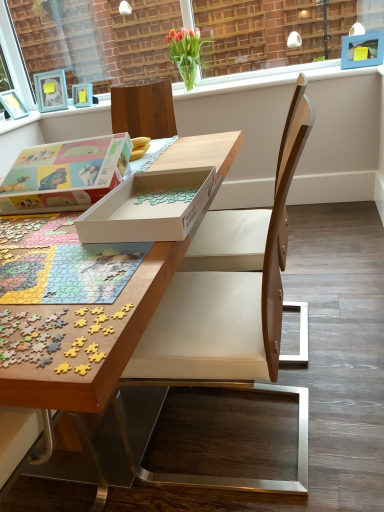
The width and height of the screenshot is (384, 512). Describe the element at coordinates (362, 50) in the screenshot. I see `blue plastic picture frame at upper right, the 2th picture frame in the left-to-right sequence` at that location.

Locate an element on the screen. white cardboard box at center, which ranks as the 1th box in left-to-right order is located at coordinates (65, 175).

Find the location of `white cardboard box at center, the 2th box from the left`. white cardboard box at center, the 2th box from the left is located at coordinates (149, 207).

I want to click on wooden chair at center, so click(x=230, y=315).

From the image's perspective, is white cardboard box at center, the 1th box when ordered from right to left, positioned above or below white cardboard box at center, which ranks as the 1th box in left-to-right order?

Clearly, from the image's perspective, white cardboard box at center, the 1th box when ordered from right to left, is below white cardboard box at center, which ranks as the 1th box in left-to-right order.

From a real-world perspective, between white cardboard box at center, the 1th box when ordered from right to left, and white cardboard box at center, which ranks as the 1th box in left-to-right order, who is vertically lower?

white cardboard box at center, the 1th box when ordered from right to left.

Which object is further away from the camera taking this photo, white cardboard box at center, the 2th box from the left, or white cardboard box at center, which is the second box from right to left?

white cardboard box at center, which is the second box from right to left, is behind.

Is wooden puzzle pieces at center spatially inside white cardboard box at center, the 2th box from the left, or outside of it?

wooden puzzle pieces at center is located beyond the bounds of white cardboard box at center, the 2th box from the left.

Between point (3, 487) and point (189, 208), which one is positioned behind?

The point (3, 487) is farther.

How many degrees apart are the facing directions of wooden puzzle pieces at center and white cardboard box at center, the 1th box when ordered from right to left?

The angular difference between wooden puzzle pieces at center and white cardboard box at center, the 1th box when ordered from right to left, is 0.755 degrees.

Which is in front, point (92, 76) or point (73, 96)?

The point (73, 96) is closer.

Is white plastic window frame at upper center facing away from matte blue picture frame at upper left, the 1th picture frame when ordered from back to front?

Yes.

Would you say wooden chair at center is inside or outside white plastic window frame at upper center?

wooden chair at center is outside white plastic window frame at upper center.

Considering the sizes of objects wooden chair at center and white plastic window frame at upper center in the image provided, who is smaller, wooden chair at center or white plastic window frame at upper center?

With smaller size is white plastic window frame at upper center.

Does wooden chair at center touch white plastic window frame at upper center?

No, wooden chair at center is not beside white plastic window frame at upper center.

From the image's perspective, does wooden chair at center appear higher than white plastic window frame at upper center?

No, from the image's perspective, wooden chair at center is not on top of white plastic window frame at upper center.

From a real-world perspective, who is located lower, wooden puzzle pieces at center or white cardboard box at center, which ranks as the 1th box in left-to-right order?

In real-world perspective, wooden puzzle pieces at center is lower.

Considering the sizes of wooden puzzle pieces at center and white cardboard box at center, which is the second box from right to left, in the image, is wooden puzzle pieces at center taller or shorter than white cardboard box at center, which is the second box from right to left,?

Clearly, wooden puzzle pieces at center is taller compared to white cardboard box at center, which is the second box from right to left.

From the image's perspective, is wooden puzzle pieces at center located above or below white cardboard box at center, which is the second box from right to left?

Clearly, from the image's perspective, wooden puzzle pieces at center is below white cardboard box at center, which is the second box from right to left.

How distant is wooden puzzle pieces at center from white cardboard box at center, which is the second box from right to left?

wooden puzzle pieces at center and white cardboard box at center, which is the second box from right to left, are 11.86 inches apart from each other.

From the white cardboard box at center, which is the second box from right to left, count 1st picture frames backward and point to it. Please provide its 2D coordinates.

[(362, 50)]

Is blue plastic picture frame at upper right, the 2th picture frame in the left-to-right sequence, looking in the opposite direction of white cardboard box at center, which ranks as the 1th box in left-to-right order?

blue plastic picture frame at upper right, the 2th picture frame in the left-to-right sequence, does not have its back to white cardboard box at center, which ranks as the 1th box in left-to-right order.

Is blue plastic picture frame at upper right, which ranks as the second picture frame in back-to-front order, behind white cardboard box at center, which ranks as the 1th box in left-to-right order?

Yes.

From the image's perspective, who appears lower, blue plastic picture frame at upper right, placed as the 1th picture frame when sorted from right to left, or white cardboard box at center, which is the second box from right to left?

white cardboard box at center, which is the second box from right to left, from the image's perspective.

Which object is positioned more to the left, blue plastic picture frame at upper right, placed as the 1th picture frame when sorted from right to left, or white cardboard box at center, the 1th box when ordered from right to left?

From the viewer's perspective, white cardboard box at center, the 1th box when ordered from right to left, appears more on the left side.

In the scene shown: Relative to white cardboard box at center, the 2th box from the left, is blue plastic picture frame at upper right, which ranks as the second picture frame in back-to-front order, in front or behind?

Clearly, blue plastic picture frame at upper right, which ranks as the second picture frame in back-to-front order, is behind white cardboard box at center, the 2th box from the left.

Could you measure the distance between blue plastic picture frame at upper right, the 2th picture frame in the left-to-right sequence, and white cardboard box at center, the 1th box when ordered from right to left?

blue plastic picture frame at upper right, the 2th picture frame in the left-to-right sequence, and white cardboard box at center, the 1th box when ordered from right to left, are 1.93 meters apart.

From the image's perspective, which is below, blue plastic picture frame at upper right, which ranks as the second picture frame in back-to-front order, or white cardboard box at center, the 1th box when ordered from right to left?

white cardboard box at center, the 1th box when ordered from right to left, is shown below in the image.

Locate an element on the screen. box in front of the white cardboard box at center, which ranks as the 1th box in left-to-right order is located at coordinates [149, 207].

Find the location of a particular element. desk below the white cardboard box at center, the 1th box when ordered from right to left (from the image's perspective) is located at coordinates (202, 153).

Looking at the image, which one is located closer to blue plastic picture frame at upper right, placed as the 1th picture frame when sorted from right to left, wooden puzzle pieces at center or white cardboard box at center, which is the second box from right to left?

wooden puzzle pieces at center is closer to blue plastic picture frame at upper right, placed as the 1th picture frame when sorted from right to left.

Based on their spatial positions, is matte blue picture frame at upper left, the second picture frame from the right, or white cardboard box at center, the 2th box from the left, further from wooden chair at center?

matte blue picture frame at upper left, the second picture frame from the right, is further to wooden chair at center.

From the image, which object appears to be farther from white cardboard box at center, the 1th box when ordered from right to left, white matte window sill at upper center or wooden chair at center?

Based on the image, white matte window sill at upper center appears to be further to white cardboard box at center, the 1th box when ordered from right to left.

In the scene shown: When comparing their distances from white cardboard box at center, the 1th box when ordered from right to left, does white plastic window frame at upper center or white cardboard box at center, which ranks as the 1th box in left-to-right order, seem closer?

The object closer to white cardboard box at center, the 1th box when ordered from right to left, is white cardboard box at center, which ranks as the 1th box in left-to-right order.

Which object lies further to the anchor point wooden chair at center, wooden puzzle pieces at center or white matte window sill at upper center?

white matte window sill at upper center lies further to wooden chair at center than the other object.

Considering their positions, is white matte window sill at upper center positioned further to white plastic window frame at upper center than blue plastic picture frame at upper right, which ranks as the second picture frame in back-to-front order?

blue plastic picture frame at upper right, which ranks as the second picture frame in back-to-front order.

Based on their spatial positions, is wooden puzzle pieces at center or wooden chair at center further from white cardboard box at center, which ranks as the 1th box in left-to-right order?

Among the two, wooden chair at center is located further to white cardboard box at center, which ranks as the 1th box in left-to-right order.

Looking at the image, which one is located closer to blue plastic picture frame at upper right, placed as the 1th picture frame when sorted from right to left, wooden puzzle pieces at center or wooden chair at center?

Among the two, wooden puzzle pieces at center is located nearer to blue plastic picture frame at upper right, placed as the 1th picture frame when sorted from right to left.

Locate an element on the screen. flower situated between white matte window sill at upper center and blue plastic picture frame at upper right, the 2th picture frame in the left-to-right sequence, from left to right is located at coordinates (186, 53).

You are a GUI agent. You are given a task and a screenshot of the screen. Output one action in this format:
    pyautogui.click(x=<x>, y=<y>)
    Task: Click on the window sill positioned between white cardboard box at center, which is the second box from right to left, and vivid tulips in glass vase at upper center from near to far
    The width and height of the screenshot is (384, 512).
    Given the screenshot: What is the action you would take?
    pyautogui.click(x=270, y=78)

This screenshot has width=384, height=512. I want to click on window sill positioned between white cardboard box at center, the 2th box from the left, and matte blue picture frame at upper left, the 1th picture frame when ordered from back to front, from near to far, so click(270, 78).

Where is `chair between white cardboard box at center, the 2th box from the left, and blue plastic picture frame at upper right, placed as the 1th picture frame when sorted from right to left, from front to back`? This screenshot has width=384, height=512. chair between white cardboard box at center, the 2th box from the left, and blue plastic picture frame at upper right, placed as the 1th picture frame when sorted from right to left, from front to back is located at coordinates (230, 315).